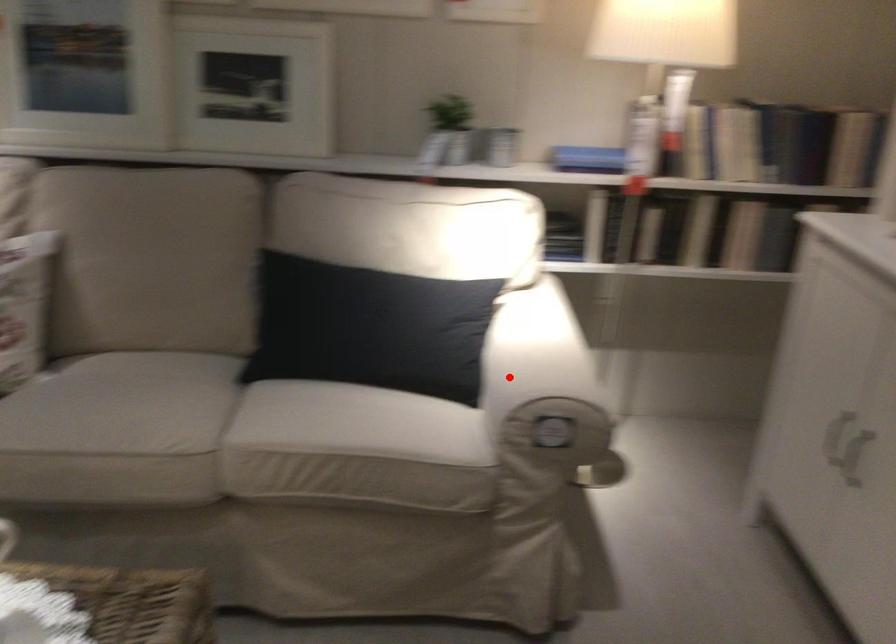
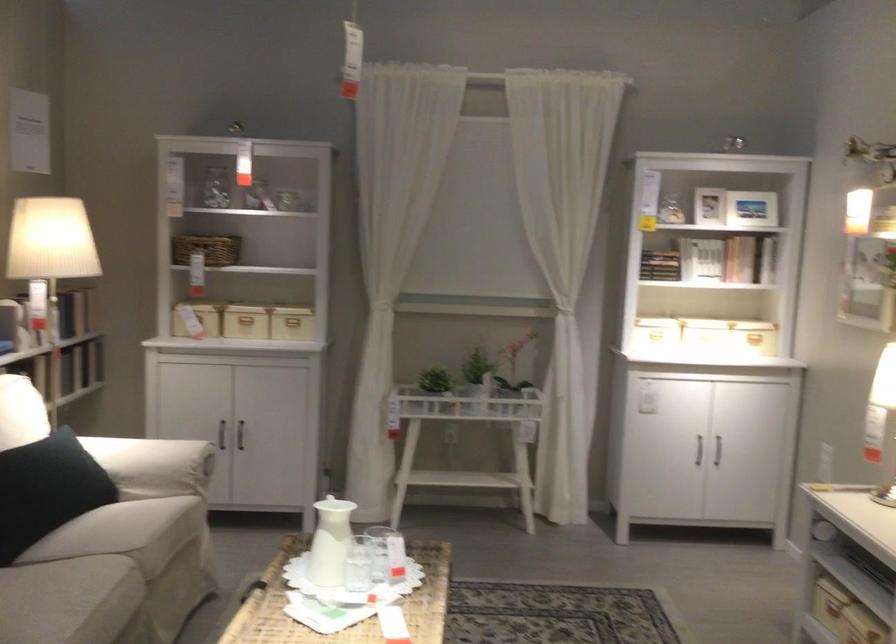
The point at the highlighted location is marked in the first image. Where is the corresponding point in the second image?

(152, 465)